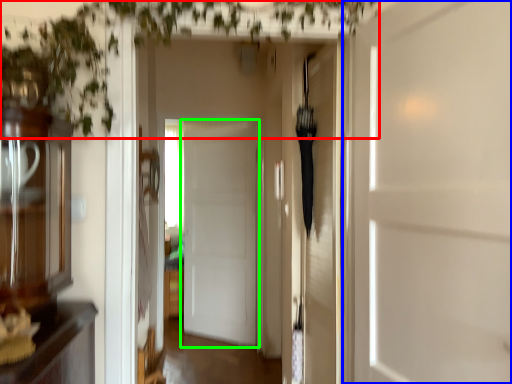
Question: Which is farther away from vegetation (highlighted by a red box)? door (highlighted by a blue box) or door (highlighted by a green box)?

Choices:
 (A) door
 (B) door

Answer: (B)